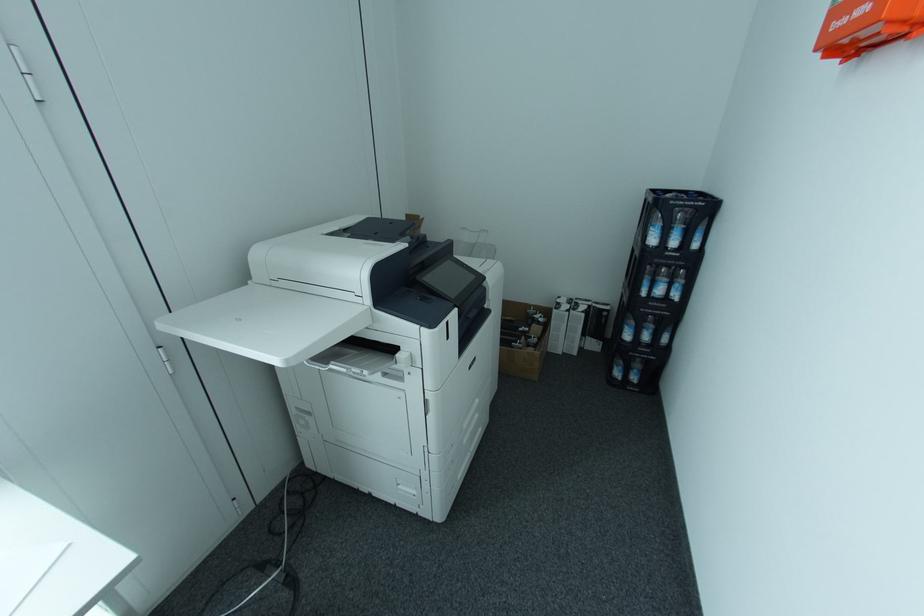
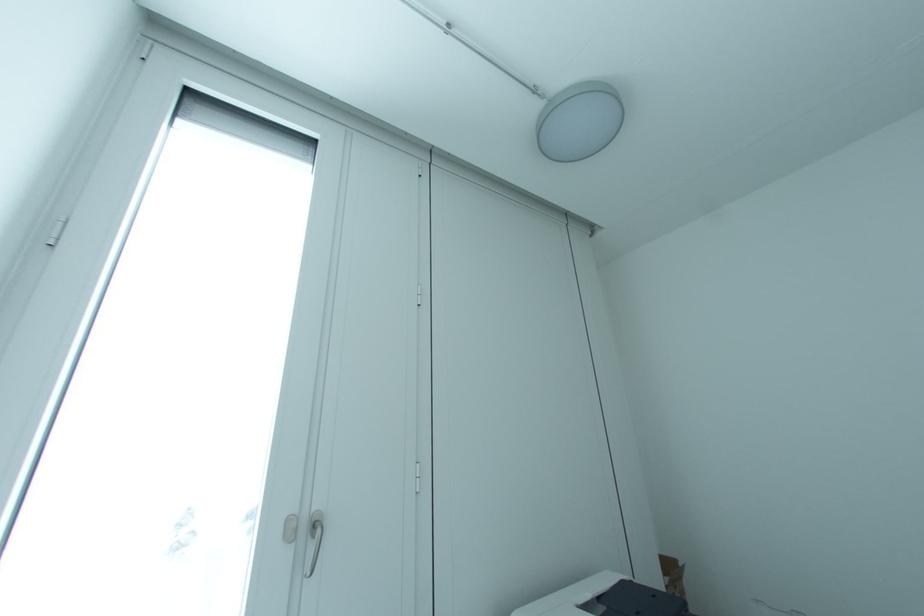
How did the camera likely rotate?

The camera's rotation is toward left-up.